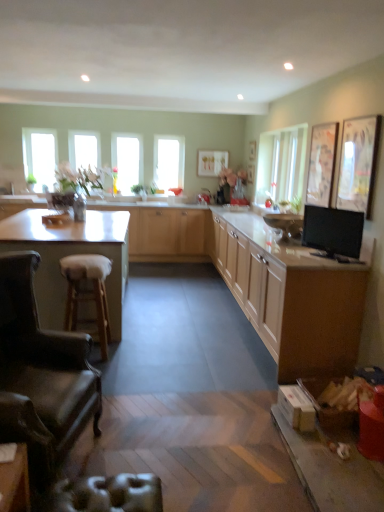
Question: Does matte wood cabinets at center, which is the third cabinetry in back-to-front order, have a lesser height compared to black glossy tv at right?

Choices:
 (A) no
 (B) yes

Answer: (A)

Question: Is matte wood cabinets at center, marked as the 1th cabinetry in a front-to-back arrangement, further to the viewer compared to black glossy tv at right?

Choices:
 (A) no
 (B) yes

Answer: (A)

Question: Does matte wood cabinets at center, which is the third cabinetry in back-to-front order, have a smaller size compared to black glossy tv at right?

Choices:
 (A) yes
 (B) no

Answer: (B)

Question: From the image's perspective, is matte wood cabinets at center, marked as the 1th cabinetry in a front-to-back arrangement, located beneath black glossy tv at right?

Choices:
 (A) no
 (B) yes

Answer: (B)

Question: From a real-world perspective, does matte wood cabinets at center, marked as the 1th cabinetry in a front-to-back arrangement, sit lower than black glossy tv at right?

Choices:
 (A) yes
 (B) no

Answer: (A)

Question: In terms of size, does metallic silver swivel chair at lower left appear bigger or smaller than clear glass window at center, which is the third window from left to right?

Choices:
 (A) big
 (B) small

Answer: (B)

Question: Is metallic silver swivel chair at lower left taller or shorter than clear glass window at center, which is the third window from left to right?

Choices:
 (A) short
 (B) tall

Answer: (A)

Question: Considering the positions of point (152, 507) and point (127, 190), is point (152, 507) closer or farther from the camera than point (127, 190)?

Choices:
 (A) farther
 (B) closer

Answer: (B)

Question: Considering their positions, is metallic silver swivel chair at lower left located in front of or behind clear glass window at center, which appears as the second window when viewed from the right?

Choices:
 (A) front
 (B) behind

Answer: (A)

Question: Is light wood cabinet at center, marked as the third cabinetry in a front-to-back arrangement, wider or thinner than metallic silver swivel chair at lower left?

Choices:
 (A) wide
 (B) thin

Answer: (A)

Question: Considering the positions of light wood cabinet at center, which appears as the first cabinetry when viewed from the back, and metallic silver swivel chair at lower left in the image, is light wood cabinet at center, which appears as the first cabinetry when viewed from the back, bigger or smaller than metallic silver swivel chair at lower left?

Choices:
 (A) big
 (B) small

Answer: (A)

Question: Considering the positions of point (185, 224) and point (64, 483), is point (185, 224) closer or farther from the camera than point (64, 483)?

Choices:
 (A) closer
 (B) farther

Answer: (B)

Question: Is light wood cabinet at center, marked as the third cabinetry in a front-to-back arrangement, inside the boundaries of metallic silver swivel chair at lower left, or outside?

Choices:
 (A) inside
 (B) outside

Answer: (B)

Question: From a real-world perspective, is metallic silver swivel chair at lower left positioned above or below light wood cabinet at center, which appears as the first cabinetry when viewed from the back?

Choices:
 (A) below
 (B) above

Answer: (A)

Question: In the image, is metallic silver swivel chair at lower left on the left side or the right side of light wood cabinet at center, marked as the third cabinetry in a front-to-back arrangement?

Choices:
 (A) left
 (B) right

Answer: (B)